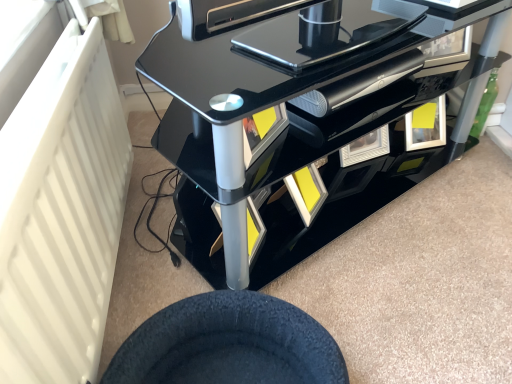
At what (x,y) coordinates should I click in order to perform the action: click on free space behind black fuzzy wheel at lower center. Please return your answer as a coordinate pair (x, y). The height and width of the screenshot is (384, 512). Looking at the image, I should click on (218, 274).